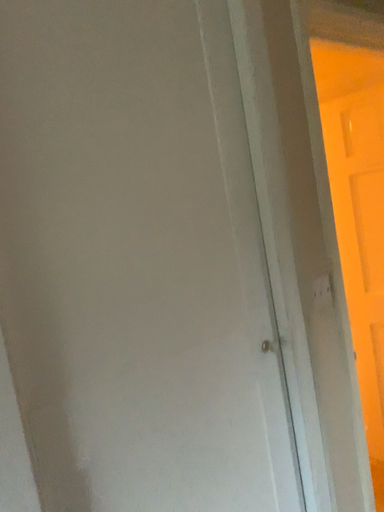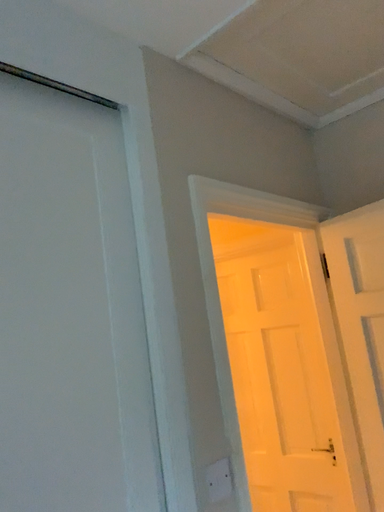
Question: Which way did the camera rotate in the video?

Choices:
 (A) rotated right
 (B) rotated left

Answer: (A)